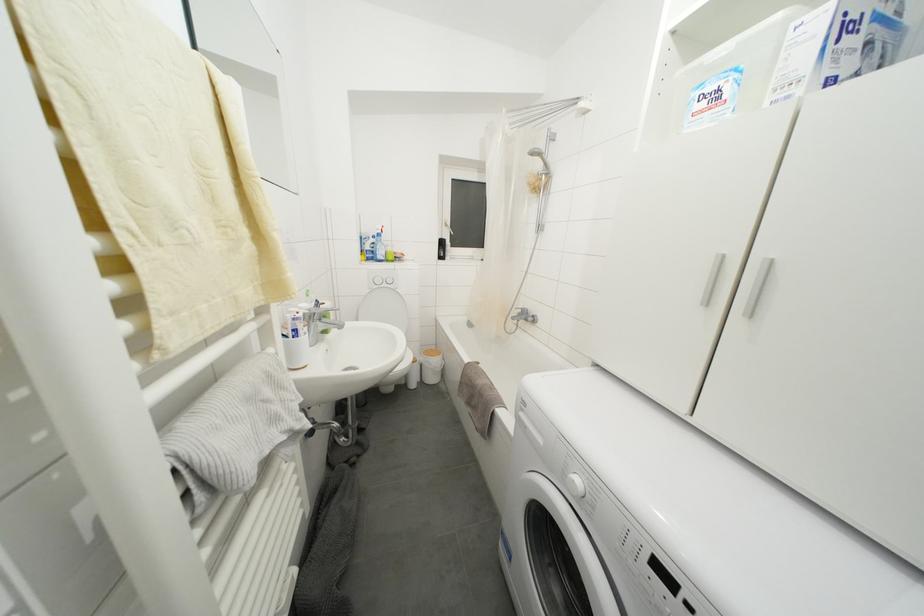
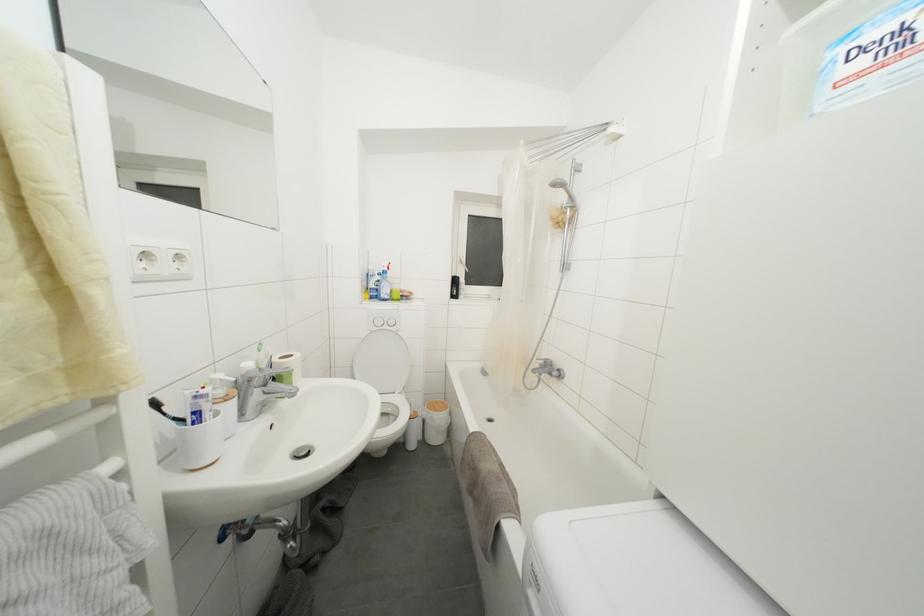
The images are taken continuously from a first-person perspective. In which direction are you moving?

The movement direction of the cameraman is right, forward.